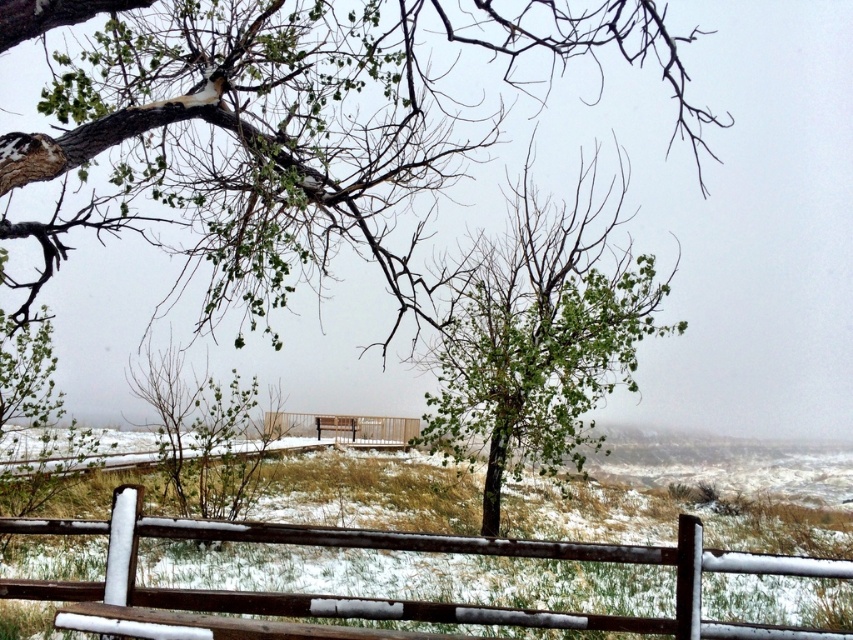
Question: Which object is farther from the camera taking this photo?

Choices:
 (A) rustic wooden fence at lower center
 (B) green leafy tree at upper left

Answer: (B)

Question: Is green leafy tree at center to the right of rustic wooden fence at lower center from the viewer's perspective?

Choices:
 (A) yes
 (B) no

Answer: (A)

Question: Does rustic wooden fence at lower center have a larger size compared to brown wooden fence at center?

Choices:
 (A) no
 (B) yes

Answer: (A)

Question: Can you confirm if green leafy tree at center is positioned to the right of rustic wooden fence at lower center?

Choices:
 (A) yes
 (B) no

Answer: (A)

Question: Which of these objects is positioned farthest from the brown wooden fence at center?

Choices:
 (A) green leafy tree at center
 (B) green leafy tree at upper left
 (C) rustic wooden fence at lower center

Answer: (C)

Question: Which point is farther to the camera?

Choices:
 (A) rustic wooden fence at lower center
 (B) brown wooden fence at center

Answer: (B)